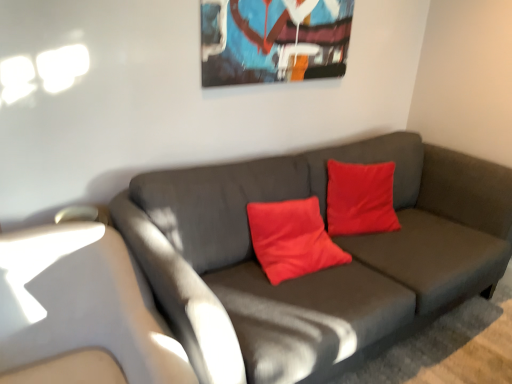
Question: Does matte gray couch at center come in front of metallic glossy picture frame at upper center?

Choices:
 (A) no
 (B) yes

Answer: (B)

Question: Is metallic glossy picture frame at upper center inside matte gray couch at center?

Choices:
 (A) no
 (B) yes

Answer: (A)

Question: Is matte gray couch at center bigger than metallic glossy picture frame at upper center?

Choices:
 (A) yes
 (B) no

Answer: (A)

Question: From a real-world perspective, is matte gray couch at center on metallic glossy picture frame at upper center?

Choices:
 (A) no
 (B) yes

Answer: (A)

Question: From the image's perspective, is matte gray couch at center under metallic glossy picture frame at upper center?

Choices:
 (A) no
 (B) yes

Answer: (B)

Question: Considering the relative sizes of matte gray couch at center and metallic glossy picture frame at upper center in the image provided, is matte gray couch at center wider than metallic glossy picture frame at upper center?

Choices:
 (A) no
 (B) yes

Answer: (B)

Question: Is metallic glossy picture frame at upper center at the left side of matte gray couch at center?

Choices:
 (A) no
 (B) yes

Answer: (B)

Question: Is metallic glossy picture frame at upper center with matte gray couch at center?

Choices:
 (A) no
 (B) yes

Answer: (A)

Question: Is metallic glossy picture frame at upper center at the right side of matte gray couch at center?

Choices:
 (A) yes
 (B) no

Answer: (B)

Question: Can you confirm if metallic glossy picture frame at upper center is bigger than matte gray couch at center?

Choices:
 (A) no
 (B) yes

Answer: (A)

Question: Does metallic glossy picture frame at upper center have a smaller size compared to matte gray couch at center?

Choices:
 (A) no
 (B) yes

Answer: (B)

Question: Is metallic glossy picture frame at upper center closer to camera compared to matte gray couch at center?

Choices:
 (A) yes
 (B) no

Answer: (B)

Question: From the image's perspective, is metallic glossy picture frame at upper center located above or below matte gray couch at center?

Choices:
 (A) below
 (B) above

Answer: (B)